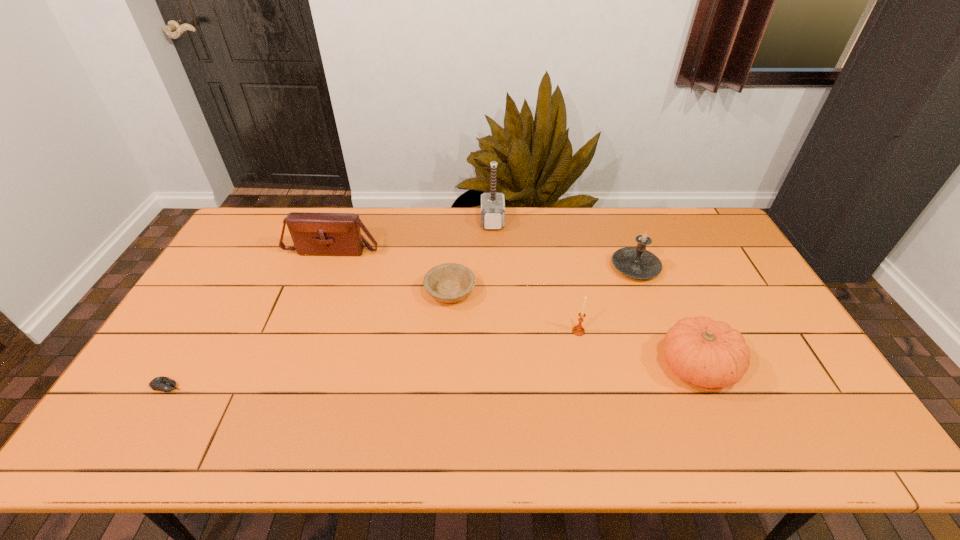
The height and width of the screenshot is (540, 960). Find the location of `free space that satisfies the following two spatial constraints: 1. on the front flap of the shoulder bag; 2. on the right side of the fifth object from left to right`. free space that satisfies the following two spatial constraints: 1. on the front flap of the shoulder bag; 2. on the right side of the fifth object from left to right is located at coordinates (301, 332).

You are a GUI agent. You are given a task and a screenshot of the screen. Output one action in this format:
    pyautogui.click(x=<x>, y=<y>)
    Task: Click on the vacant area that satisfies the following two spatial constraints: 1. on the front side of the second shortest object; 2. on the left side of the pumpkin
    This screenshot has height=540, width=960.
    Given the screenshot: What is the action you would take?
    [445, 366]

You are a GUI agent. You are given a task and a screenshot of the screen. Output one action in this format:
    pyautogui.click(x=<x>, y=<y>)
    Task: Click on the free space in the image that satisfies the following two spatial constraints: 1. on the back side of the candle; 2. on the left side of the computer mouse
    The height and width of the screenshot is (540, 960).
    Given the screenshot: What is the action you would take?
    pyautogui.click(x=238, y=267)

Find the location of `free space that satisfies the following two spatial constraints: 1. for striking with the head of the hammer; 2. on the back side of the pumpkin`. free space that satisfies the following two spatial constraints: 1. for striking with the head of the hammer; 2. on the back side of the pumpkin is located at coordinates (497, 366).

Locate an element on the screen. The height and width of the screenshot is (540, 960). free space in the image that satisfies the following two spatial constraints: 1. for striking with the head of the farthest object; 2. on the front flap of the second object from left to right is located at coordinates (493, 248).

Identify the location of blank space that satisfies the following two spatial constraints: 1. on the front side of the fifth object from left to right; 2. on the right side of the bowl. (447, 332).